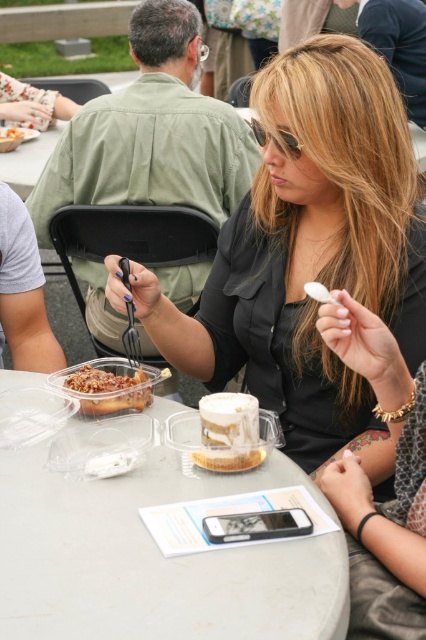
At what (x,y) coordinates should I click in order to perform the action: click on green fabric shirt at upper left. Please return your answer as a coordinate pair (x, y). Image resolution: width=426 pixels, height=640 pixels. Looking at the image, I should click on (152, 132).

Does green fabric shirt at upper left have a lesser width compared to matte brown pie at center?

No.

Is point (55, 193) more distant than point (8, 132)?

No, it is in front of (8, 132).

Locate an element on the screen. green fabric shirt at upper left is located at coordinates (152, 132).

Which is above, white plastic table at center or matte brown pie at center?

matte brown pie at center is higher up.

Does white plastic table at center have a lesser height compared to matte brown pie at center?

No, white plastic table at center is not shorter than matte brown pie at center.

Is point (51, 490) behind point (0, 131)?

No, it is in front of (0, 131).

You are a GUI agent. You are given a task and a screenshot of the screen. Output one action in this format:
    pyautogui.click(x=<x>, y=<y>)
    Task: Click on the white plastic table at center
    Image resolution: width=426 pixels, height=640 pixels.
    Given the screenshot: What is the action you would take?
    pyautogui.click(x=155, y=561)

Is point (241, 440) closer to viewer compared to point (106, 365)?

Yes, point (241, 440) is in front of point (106, 365).

Measure the distance between white frosted cake at center and camera.

white frosted cake at center is 3.94 feet away from camera.

This screenshot has height=640, width=426. I want to click on white frosted cake at center, so click(x=229, y=433).